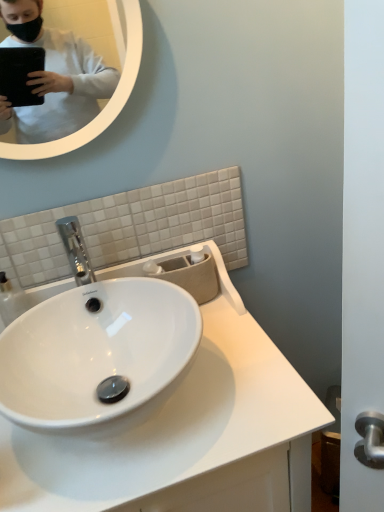
Question: Do you think white glossy mirror at upper left is within white glossy sink at center, or outside of it?

Choices:
 (A) outside
 (B) inside

Answer: (A)

Question: In terms of width, does white glossy mirror at upper left look wider or thinner when compared to white glossy sink at center?

Choices:
 (A) wide
 (B) thin

Answer: (B)

Question: Is white glossy mirror at upper left bigger or smaller than white glossy sink at center?

Choices:
 (A) big
 (B) small

Answer: (B)

Question: Is point (21, 470) closer or farther from the camera than point (79, 38)?

Choices:
 (A) farther
 (B) closer

Answer: (B)

Question: Is white glossy sink at center wider or thinner than white glossy mirror at upper left?

Choices:
 (A) thin
 (B) wide

Answer: (B)

Question: In terms of height, does white glossy sink at center look taller or shorter compared to white glossy mirror at upper left?

Choices:
 (A) short
 (B) tall

Answer: (B)

Question: From a real-world perspective, relative to white glossy mirror at upper left, is white glossy sink at center vertically above or below?

Choices:
 (A) above
 (B) below

Answer: (B)